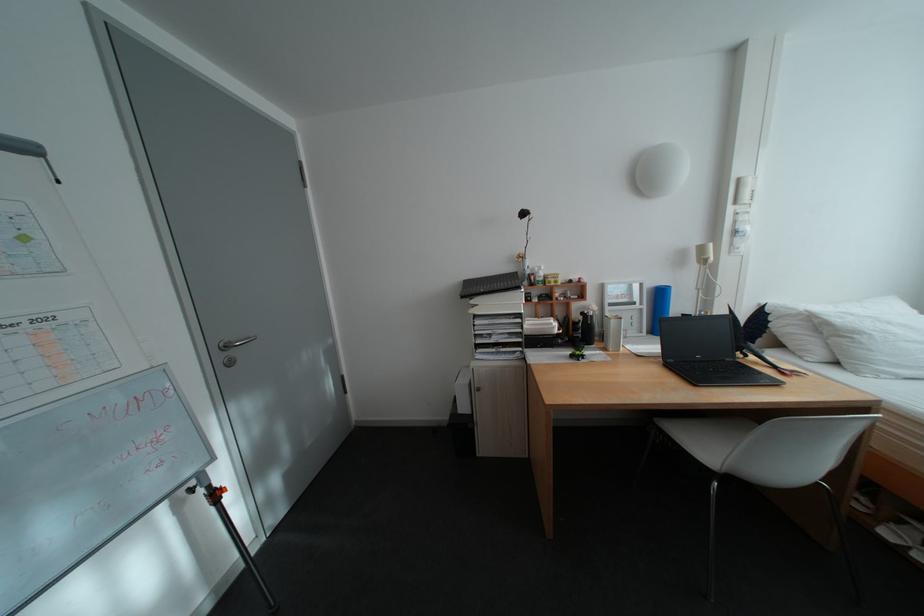
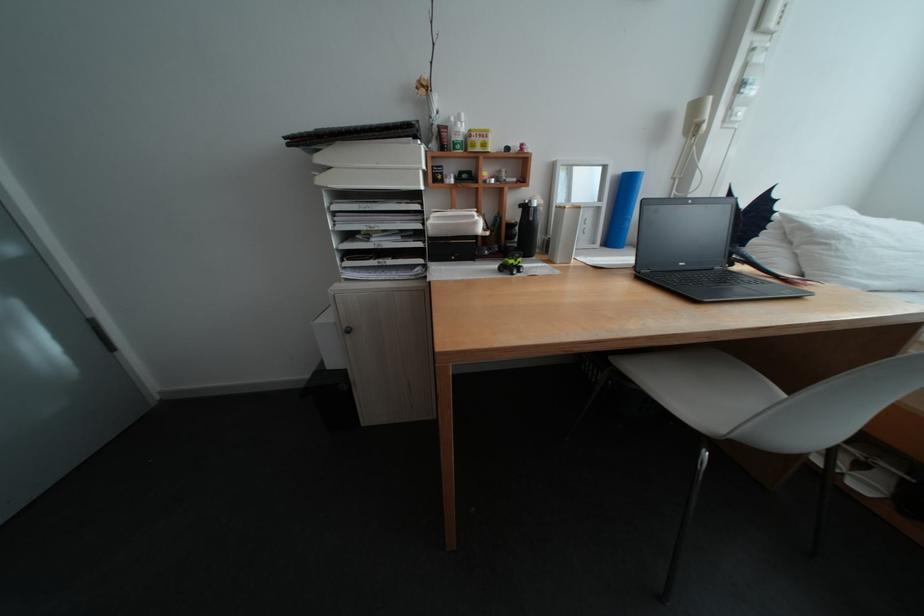
Locate, in the second image, the point that corresponds to pixel 485 302 in the first image.

(333, 160)